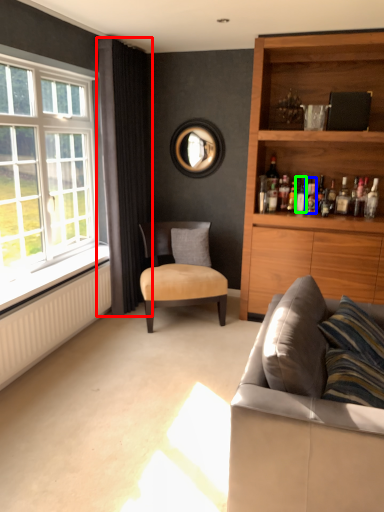
Question: Which is nearer to the curtain (highlighted by a red box)? bottle (highlighted by a blue box) or bottle (highlighted by a green box).

Choices:
 (A) bottle
 (B) bottle

Answer: (B)